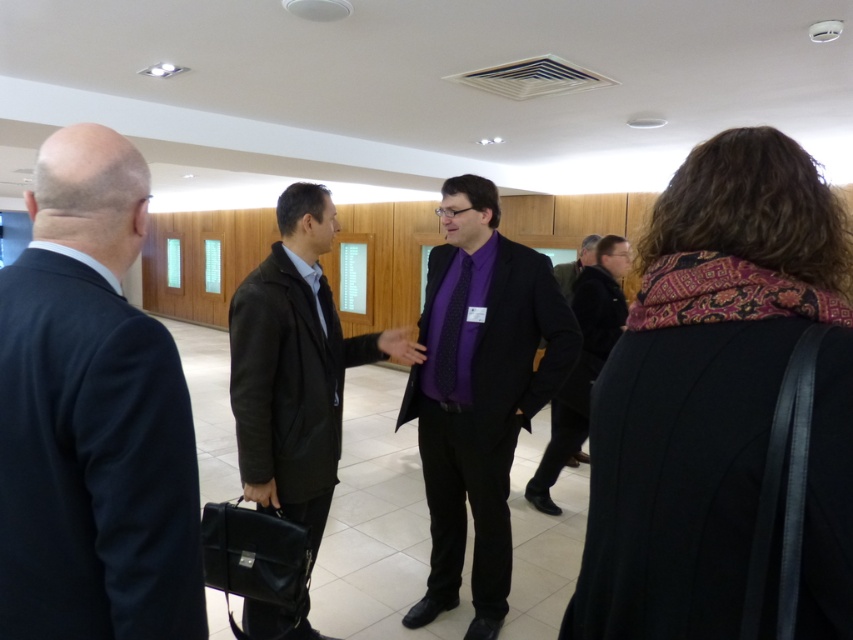
You are standing in the conference room and want to reach a point that is exactly at coordinates point (x=325, y=340). If you are currently 2 meters away from that point, how much further do you need to walk to reach it?

The distance of point (x=325, y=340) from viewer is 2.15 meters. Since you are currently 2 meters away, you need to walk an additional 0.15 meters to reach the point.

You are standing in the conference room and want to move from the point marked as point (308, 227) to the point marked as point (583, 276). Which direction should you move in to reach your destination?

To move from point (308, 227) to point (583, 276), you should move towards the upper right direction since point (583, 276) is located above and to the right of point (308, 227).

You are an event planner arranging a photo shoot in the conference room. You need to position a 1.8m tall standee behind the matte black suit at center and the purple woven tie at center. Which object will the standee tower over more?

The standee will tower over the purple woven tie at center more because the matte black suit at center is taller than the purple woven tie at center, so the standee will appear taller relative to the tie.